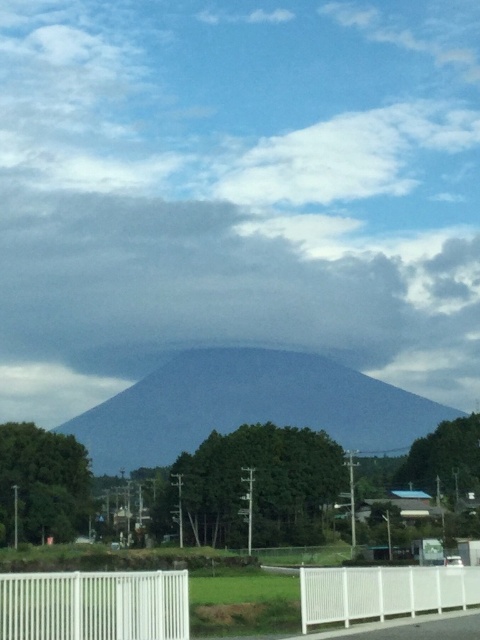
Question: Can you confirm if blue matte mountain at center is thinner than white plastic fence at lower right?

Choices:
 (A) no
 (B) yes

Answer: (A)

Question: Among these points, which one is farthest from the camera?

Choices:
 (A) (91, 637)
 (B) (217, 403)
 (C) (326, 580)

Answer: (B)

Question: Among these objects, which one is nearest to the camera?

Choices:
 (A) white plastic fence at lower left
 (B) blue matte mountain at center
 (C) white plastic fence at lower right
 (D) gray/cloudy sky at center

Answer: (A)

Question: Does gray/cloudy sky at center appear over white plastic fence at lower left?

Choices:
 (A) yes
 (B) no

Answer: (A)

Question: Does gray/cloudy sky at center appear over white plastic fence at lower right?

Choices:
 (A) yes
 (B) no

Answer: (A)

Question: Among these points, which one is farthest from the camera?

Choices:
 (A) (342, 387)
 (B) (179, 579)

Answer: (A)